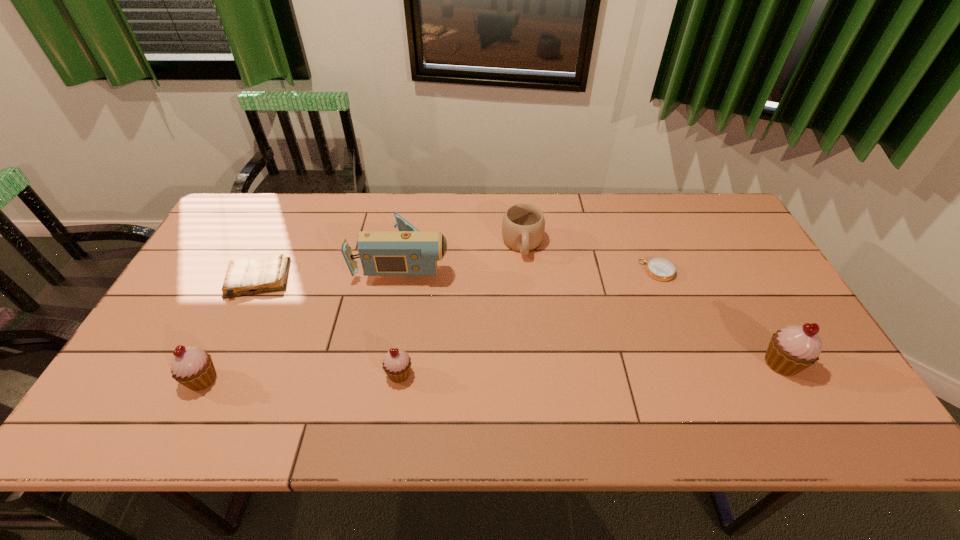
To make them evenly spaced by inserting another cupcake among them, please locate a vacant spot for this new cupcake. Please provide its 2D coordinates. Your answer should be formatted as a tuple, i.e. [(x, y)], where the tuple contains the x and y coordinates of a point satisfying the conditions above.

[(592, 368)]